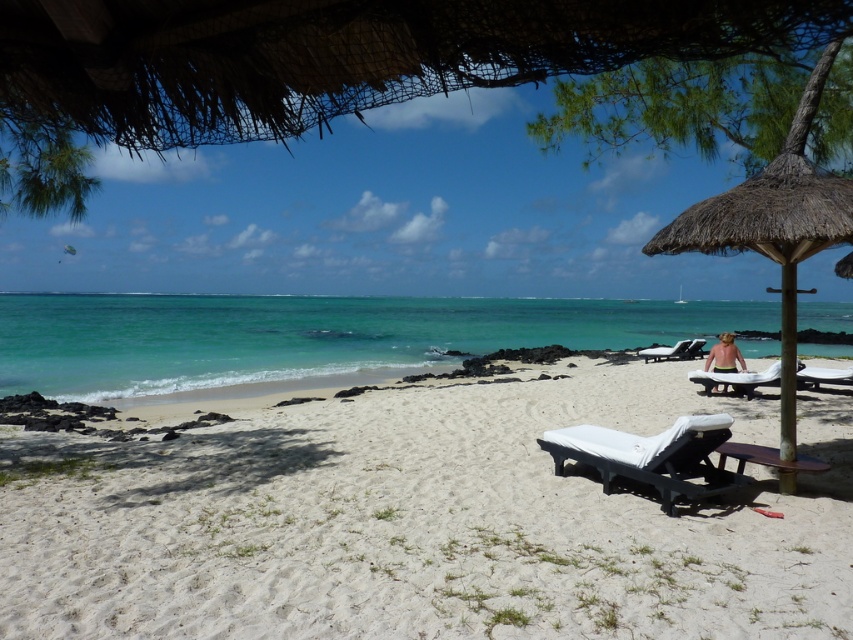
Question: Which of these objects is positioned closest to the thatched straw umbrella at right?

Choices:
 (A) yellow fabric bikini at center
 (B) white plastic beach chair at center-right

Answer: (B)

Question: Based on their relative distances, which object is farther from the thatched straw umbrella at right?

Choices:
 (A) white matte beach chair at center
 (B) yellow fabric bikini at center
 (C) white sand at center

Answer: (B)

Question: Which point is farther to the camera?

Choices:
 (A) white fabric beach chair at center-right
 (B) white sand at center

Answer: (A)

Question: Considering the relative positions of white matte beach chair at center and white plastic beach chair at center-right in the image provided, where is white matte beach chair at center located with respect to white plastic beach chair at center-right?

Choices:
 (A) right
 (B) left

Answer: (B)

Question: Does white plastic beach chair at center-right have a smaller size compared to white fabric beach chair at center-right?

Choices:
 (A) yes
 (B) no

Answer: (B)

Question: Can you confirm if white plastic beach chair at center-right is wider than white fabric beach chair at center-right?

Choices:
 (A) no
 (B) yes

Answer: (B)